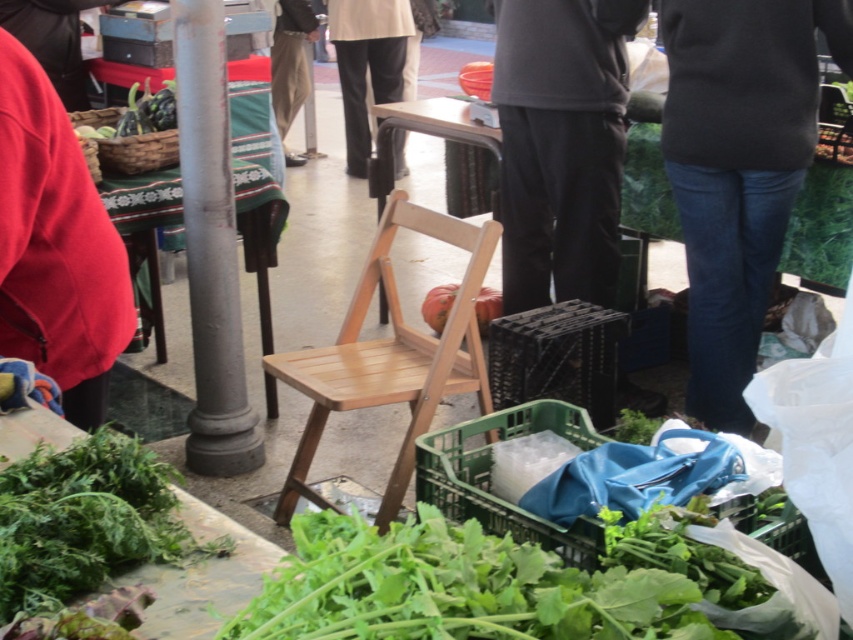
Is dark gray hoodie at center to the right of green leafy vegetable at upper left from the viewer's perspective?

Indeed, dark gray hoodie at center is positioned on the right side of green leafy vegetable at upper left.

Is point (618, 113) less distant than point (134, 112)?

No, (618, 113) is behind (134, 112).

The image size is (853, 640). Identify the location of dark gray hoodie at center. (561, 145).

Does dark gray sweater at upper right have a smaller size compared to green leafy at lower center?

Incorrect, dark gray sweater at upper right is not smaller in size than green leafy at lower center.

Does dark gray sweater at upper right have a greater height compared to green leafy at lower center?

Yes, dark gray sweater at upper right is taller than green leafy at lower center.

Is point (714, 115) less distant than point (280, 593)?

No, it is behind (280, 593).

The image size is (853, 640). Identify the location of dark gray sweater at upper right. (738, 168).

You are a GUI agent. You are given a task and a screenshot of the screen. Output one action in this format:
    pyautogui.click(x=<x>, y=<y>)
    Task: Click on the green leafy at lower center
    This screenshot has height=640, width=853.
    Given the screenshot: What is the action you would take?
    pyautogui.click(x=456, y=588)

In order to click on green leafy at lower center in this screenshot , I will do `click(456, 588)`.